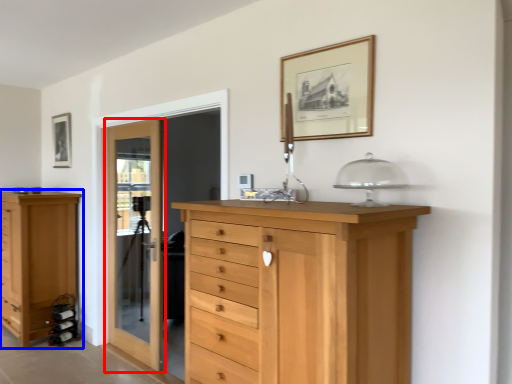
Question: Which object is further to the camera taking this photo, door (highlighted by a red box) or chest of drawers (highlighted by a blue box)?

Choices:
 (A) door
 (B) chest of drawers

Answer: (B)